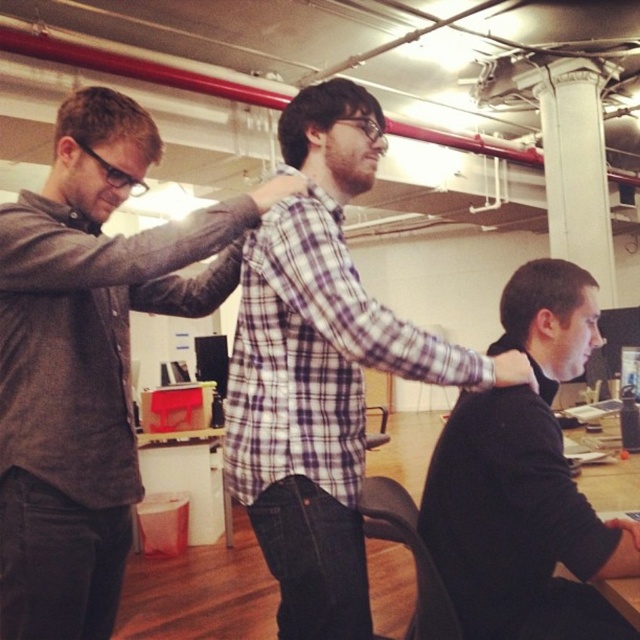
Does gray matte shirt at center appear on the left side of plaid shirt at center?

Yes, gray matte shirt at center is to the left of plaid shirt at center.

This screenshot has height=640, width=640. I want to click on gray matte shirt at center, so click(88, 358).

Identify the location of gray matte shirt at center. (88, 358).

Is plaid shirt at center to the right of white smooth column at upper center from the viewer's perspective?

Incorrect, plaid shirt at center is not on the right side of white smooth column at upper center.

Who is positioned more to the right, plaid shirt at center or white smooth column at upper center?

white smooth column at upper center is more to the right.

Who is more distant from viewer, (305, 237) or (573, 205)?

Point (573, 205)

You are a GUI agent. You are given a task and a screenshot of the screen. Output one action in this format:
    pyautogui.click(x=<x>, y=<y>)
    Task: Click on the plaid shirt at center
    The width and height of the screenshot is (640, 640).
    Given the screenshot: What is the action you would take?
    321,369

Does gray matte shirt at center have a lesser height compared to black sweater at center?

No, gray matte shirt at center is not shorter than black sweater at center.

Between point (32, 221) and point (506, 483), which one is positioned behind?

The point (506, 483) is more distant.

What do you see at coordinates (88, 358) in the screenshot? The image size is (640, 640). I see `gray matte shirt at center` at bounding box center [88, 358].

The image size is (640, 640). I want to click on gray matte shirt at center, so click(88, 358).